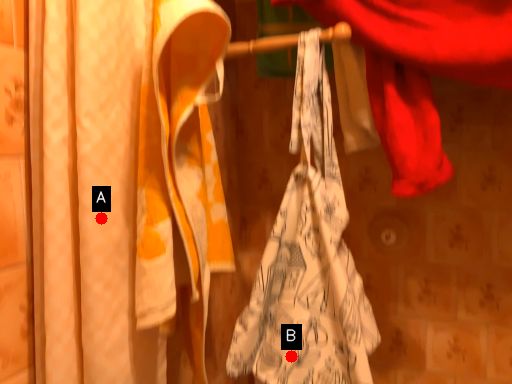
Question: Two points are circled on the image, labeled by A and B beside each circle. Which point is closer to the camera?

Choices:
 (A) A is closer
 (B) B is closer

Answer: (A)